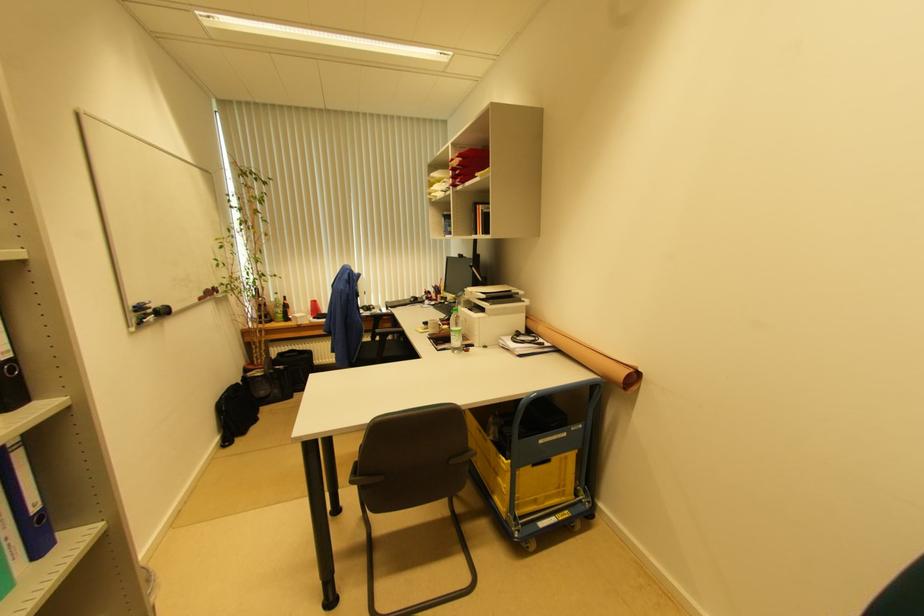
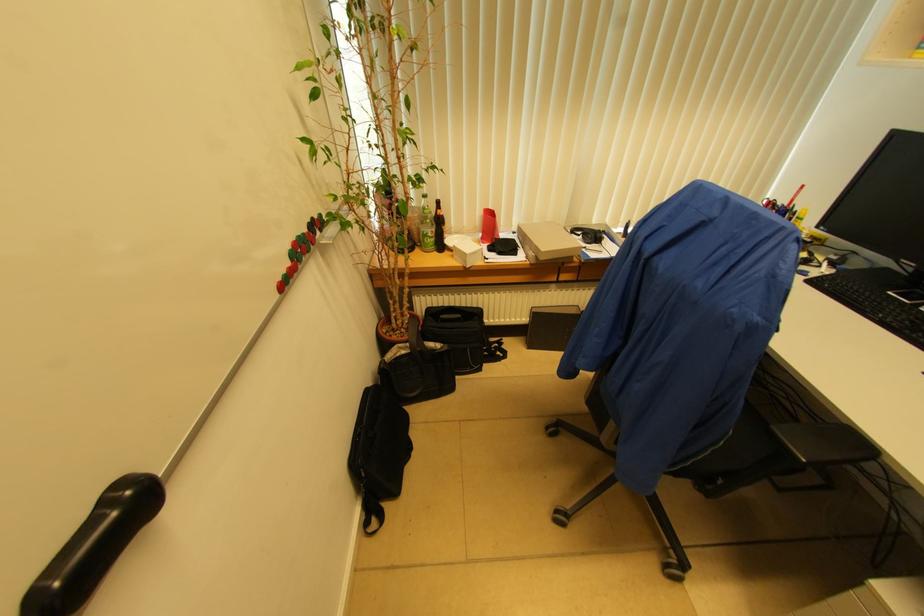
Locate, in the second image, the point that corresponds to [155,312] in the first image.

(35, 600)